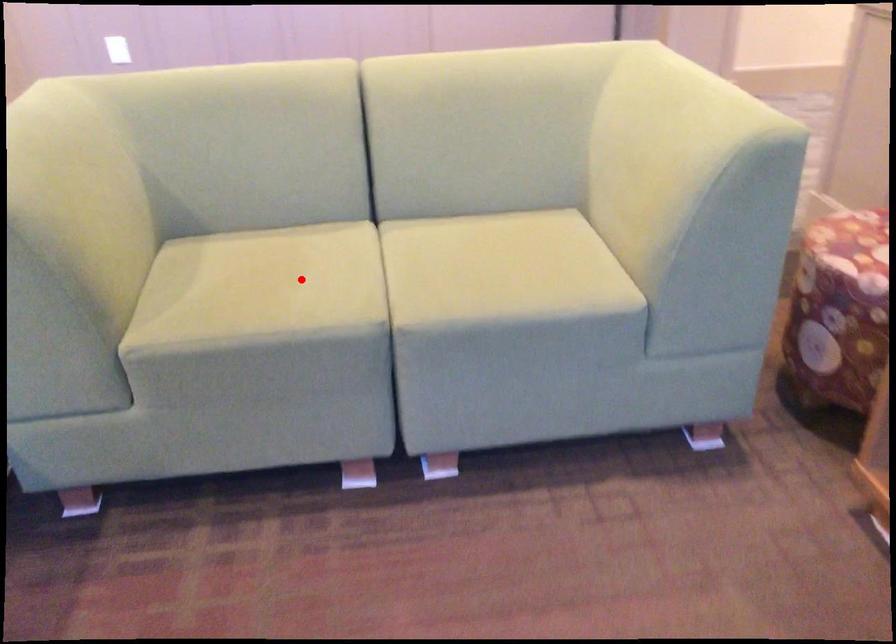
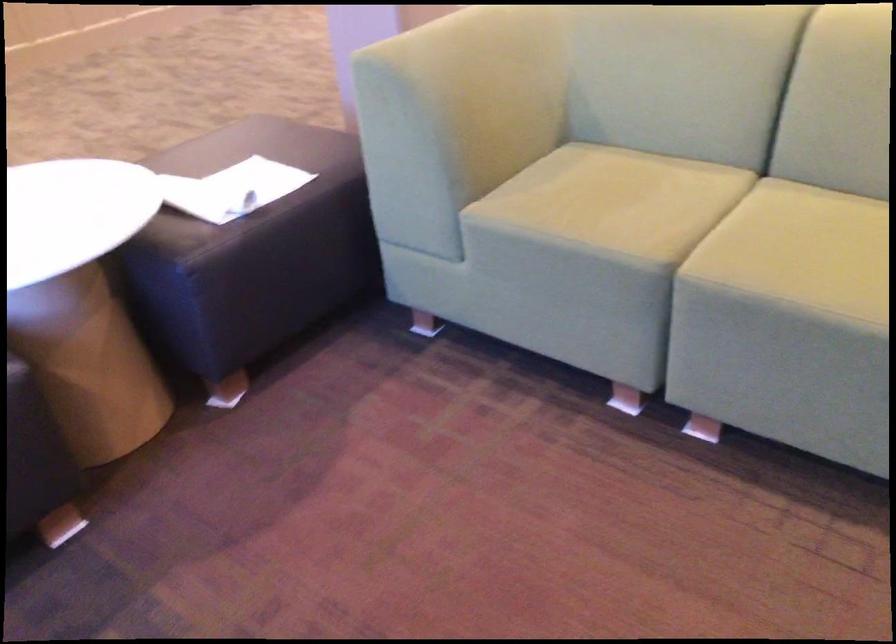
The point at the highlighted location is marked in the first image. Where is the corresponding point in the second image?

(636, 202)